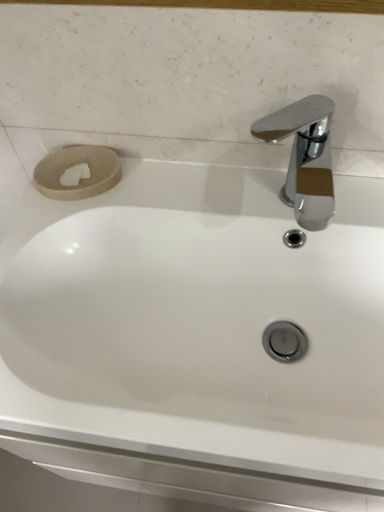
Describe the element at coordinates (305, 157) in the screenshot. I see `chrome/metallic faucet at upper right` at that location.

Locate an element on the screen. The image size is (384, 512). chrome/metallic faucet at upper right is located at coordinates (305, 157).

The image size is (384, 512). What do you see at coordinates (79, 172) in the screenshot?
I see `beige matte toilet paper at upper left` at bounding box center [79, 172].

Find the location of a particular element. This screenshot has width=384, height=512. beige matte toilet paper at upper left is located at coordinates (79, 172).

At what (x,y) coordinates should I click in order to perform the action: click on chrome/metallic faucet at upper right. Please return your answer as a coordinate pair (x, y). The image size is (384, 512). Looking at the image, I should click on (305, 157).

In the image, is chrome/metallic faucet at upper right on the left side or the right side of beige matte toilet paper at upper left?

Based on their positions, chrome/metallic faucet at upper right is located to the right of beige matte toilet paper at upper left.

Which is behind, chrome/metallic faucet at upper right or beige matte toilet paper at upper left?

beige matte toilet paper at upper left is more distant.

Is point (303, 183) positioned after point (42, 184)?

Yes, point (303, 183) is behind point (42, 184).

From the image's perspective, is chrome/metallic faucet at upper right positioned above or below beige matte toilet paper at upper left?

chrome/metallic faucet at upper right is situated lower than beige matte toilet paper at upper left in the image.

From a real-world perspective, who is located higher, chrome/metallic faucet at upper right or beige matte toilet paper at upper left?

From a 3D spatial view, chrome/metallic faucet at upper right is above.

In the scene shown: In terms of width, does chrome/metallic faucet at upper right look wider or thinner when compared to beige matte toilet paper at upper left?

chrome/metallic faucet at upper right is wider than beige matte toilet paper at upper left.

Between chrome/metallic faucet at upper right and beige matte toilet paper at upper left, which one has less height?

With less height is beige matte toilet paper at upper left.

Looking at the image, does chrome/metallic faucet at upper right seem bigger or smaller compared to beige matte toilet paper at upper left?

Clearly, chrome/metallic faucet at upper right is larger in size than beige matte toilet paper at upper left.

Do you think chrome/metallic faucet at upper right is within beige matte toilet paper at upper left, or outside of it?

chrome/metallic faucet at upper right is located beyond the bounds of beige matte toilet paper at upper left.

Is there a large distance between chrome/metallic faucet at upper right and beige matte toilet paper at upper left?

Yes, chrome/metallic faucet at upper right and beige matte toilet paper at upper left are located far from each other.

Could you tell me if chrome/metallic faucet at upper right is turned towards beige matte toilet paper at upper left?

No, chrome/metallic faucet at upper right is not turned towards beige matte toilet paper at upper left.

How different are the orientations of chrome/metallic faucet at upper right and beige matte toilet paper at upper left in degrees?

1.4e-05 degrees separate the facing orientations of chrome/metallic faucet at upper right and beige matte toilet paper at upper left.

Image resolution: width=384 pixels, height=512 pixels. Identify the location of toilet paper lying above the chrome/metallic faucet at upper right (from the image's perspective). (79, 172).

From the picture: Considering the positions of objects beige matte toilet paper at upper left and chrome/metallic faucet at upper right in the image provided, who is more to the right, beige matte toilet paper at upper left or chrome/metallic faucet at upper right?

chrome/metallic faucet at upper right.

Is beige matte toilet paper at upper left closer to camera compared to chrome/metallic faucet at upper right?

No, it is behind chrome/metallic faucet at upper right.

Is point (48, 160) positioned in front of point (294, 164)?

No, (48, 160) is behind (294, 164).

From the image's perspective, which one is positioned lower, beige matte toilet paper at upper left or chrome/metallic faucet at upper right?

chrome/metallic faucet at upper right is shown below in the image.

From a real-world perspective, is beige matte toilet paper at upper left under chrome/metallic faucet at upper right?

Yes, from a real-world perspective, beige matte toilet paper at upper left is beneath chrome/metallic faucet at upper right.

Does beige matte toilet paper at upper left have a greater width compared to chrome/metallic faucet at upper right?

No.

In the scene shown: Considering the sizes of objects beige matte toilet paper at upper left and chrome/metallic faucet at upper right in the image provided, who is taller, beige matte toilet paper at upper left or chrome/metallic faucet at upper right?

chrome/metallic faucet at upper right is taller.

Does beige matte toilet paper at upper left have a smaller size compared to chrome/metallic faucet at upper right?

Yes, beige matte toilet paper at upper left is smaller than chrome/metallic faucet at upper right.

Consider the image. Is beige matte toilet paper at upper left not within chrome/metallic faucet at upper right?

That's correct, beige matte toilet paper at upper left is outside of chrome/metallic faucet at upper right.

In the scene shown: Is beige matte toilet paper at upper left touching chrome/metallic faucet at upper right?

They are not placed beside each other.

Does beige matte toilet paper at upper left turn towards chrome/metallic faucet at upper right?

No, beige matte toilet paper at upper left is not turned towards chrome/metallic faucet at upper right.

Measure the distance from beige matte toilet paper at upper left to chrome/metallic faucet at upper right.

5.39 feet.

Find the location of a particular element. toilet paper behind the chrome/metallic faucet at upper right is located at coordinates (79, 172).

This screenshot has width=384, height=512. I want to click on toilet paper beneath the chrome/metallic faucet at upper right (from a real-world perspective), so click(79, 172).

Find the location of `toilet paper behind the chrome/metallic faucet at upper right`. toilet paper behind the chrome/metallic faucet at upper right is located at coordinates (79, 172).